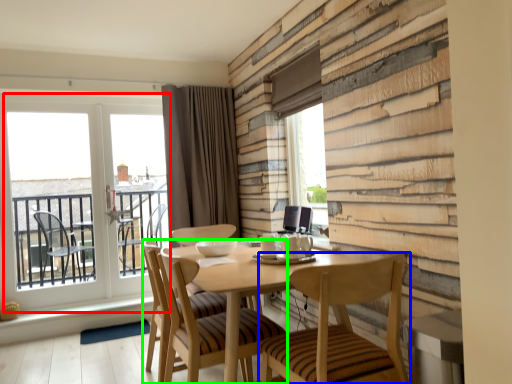
Question: Estimate the real-world distances between objects in this image. Which object is closer to window (highlighted by a red box), chair (highlighted by a blue box) or chair (highlighted by a green box)?

Choices:
 (A) chair
 (B) chair

Answer: (B)